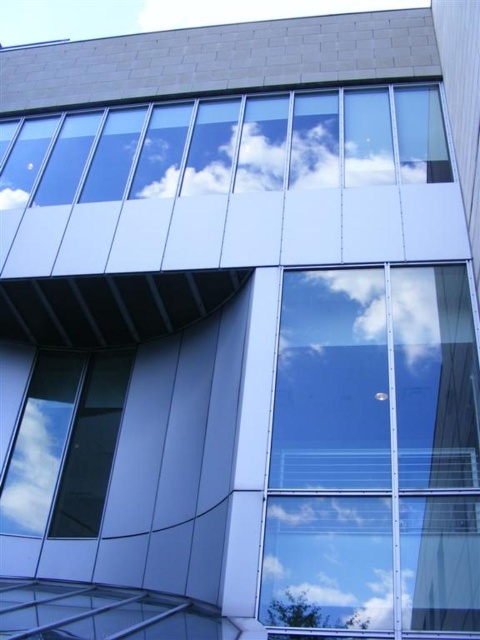
Between point (367, 625) and point (17, 202), which one is positioned in front?

Point (367, 625) is more forward.

Is transparent glass window at center smaller than white fluffy cloud at upper left?

No.

Which is in front, point (394, 417) or point (3, 205)?

Point (394, 417) is in front.

The height and width of the screenshot is (640, 480). Find the location of `transparent glass window at center`. transparent glass window at center is located at coordinates (374, 452).

Does point (60, 400) lie behind point (319, 275)?

That is True.

Is transparent glass window at lower left bigger than white fluffy cloud at center?

Yes.

Is point (72, 429) farther from camera compared to point (325, 360)?

Yes, point (72, 429) is behind point (325, 360).

Where is `transparent glass window at lower left`? This screenshot has height=640, width=480. transparent glass window at lower left is located at coordinates point(64,445).

Looking at this image, between transparent glass window at lower left and white fluffy cloud at upper left, which one has less height?

With less height is white fluffy cloud at upper left.

Does transparent glass window at lower left have a smaller size compared to white fluffy cloud at upper left?

No.

Is point (88, 365) positioned behind point (1, 184)?

No, (88, 365) is in front of (1, 184).

The width and height of the screenshot is (480, 640). Identify the location of transparent glass window at lower left. (64, 445).